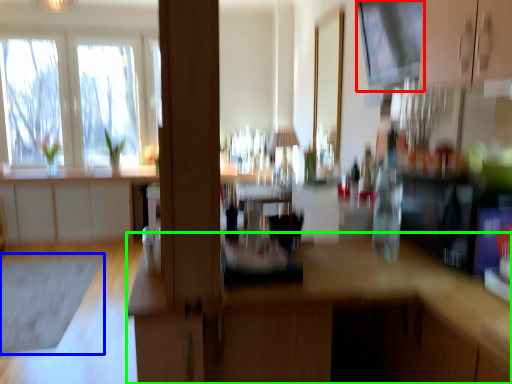
Question: Which is farther away from window screen (highlighted by a red box)? mat (highlighted by a blue box) or computer desk (highlighted by a green box)?

Choices:
 (A) mat
 (B) computer desk

Answer: (A)